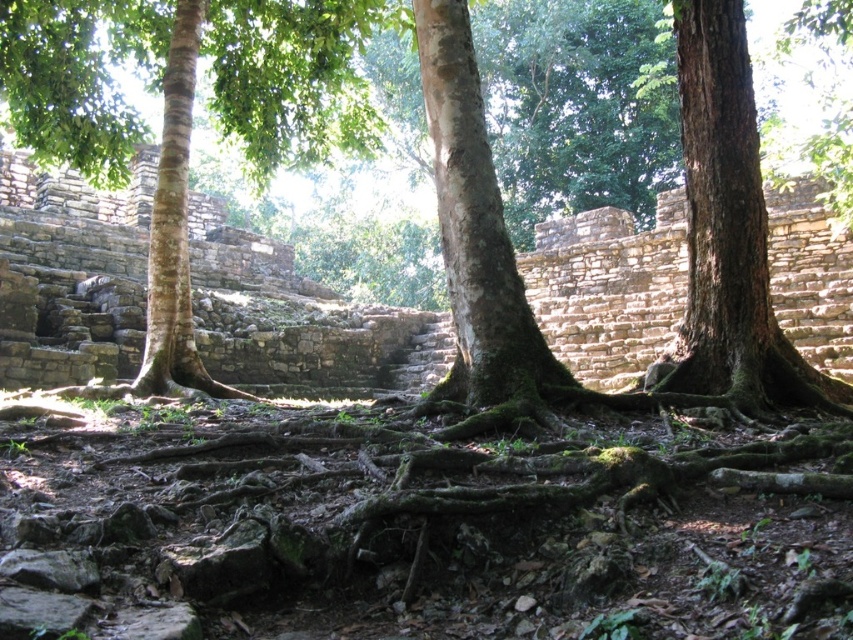
Question: Which point is farther to the camera?

Choices:
 (A) brown rough tree trunk at left
 (B) brown rough tree at center
 (C) green rough bark tree at center

Answer: (A)

Question: Can you confirm if brown rough tree at center is positioned above brown rough tree trunk at left?

Choices:
 (A) yes
 (B) no

Answer: (B)

Question: Does brown rough tree at center appear under green rough bark tree at center?

Choices:
 (A) yes
 (B) no

Answer: (B)

Question: Which point is closer to the camera taking this photo?

Choices:
 (A) (697, 227)
 (B) (729, 246)

Answer: (B)

Question: Among these objects, which one is farthest from the camera?

Choices:
 (A) green rough bark tree at center
 (B) brown rough tree trunk at left

Answer: (B)

Question: Can you confirm if brown rough tree at center is positioned to the right of green rough bark tree at center?

Choices:
 (A) yes
 (B) no

Answer: (B)